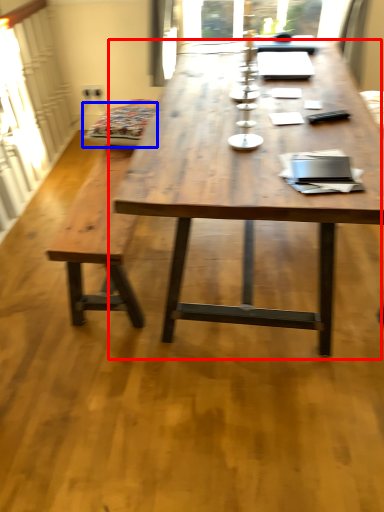
Question: Which point is closer to the camera, coffee table (highlighted by a red box) or swivel chair (highlighted by a blue box)?

Choices:
 (A) coffee table
 (B) swivel chair

Answer: (A)